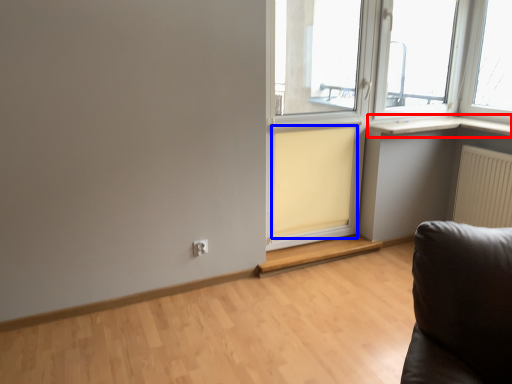
Question: Among these objects, which one is nearest to the camera, window sill (highlighted by a red box) or curtain (highlighted by a blue box)?

Choices:
 (A) window sill
 (B) curtain

Answer: (B)